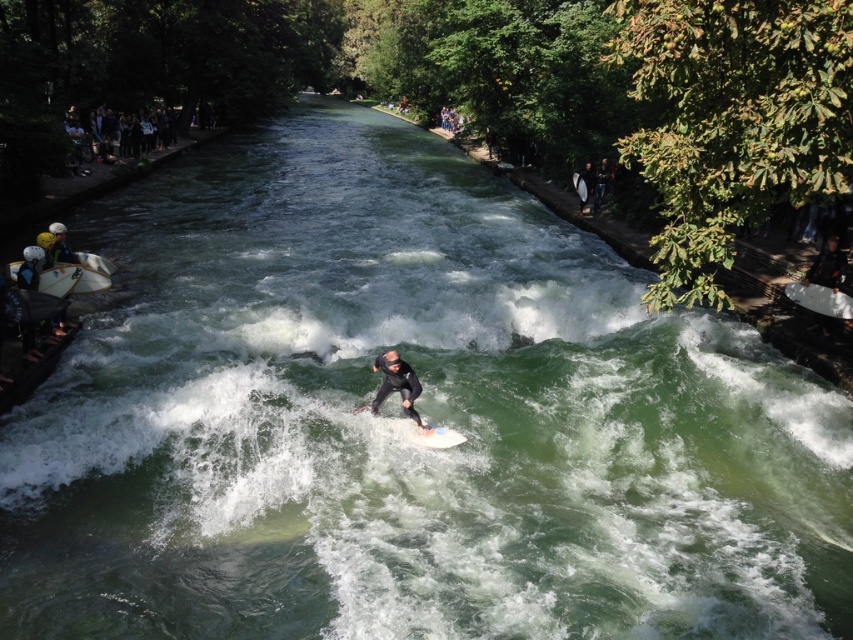
Question: Which object is closer to the camera taking this photo?

Choices:
 (A) dark blue wetsuit at upper right
 (B) black wetsuit surfer at center
 (C) white smooth surfboard at center
 (D) white foam surfboard at center

Answer: (D)

Question: Can you confirm if white glossy surfboard at left is positioned above white smooth surfboard at center?

Choices:
 (A) no
 (B) yes

Answer: (B)

Question: Which object is closer to the camera taking this photo?

Choices:
 (A) dark blue wetsuit at upper right
 (B) white smooth surfboard at center
 (C) black wetsuit surfer at center
 (D) white glossy surfboard at left

Answer: (C)

Question: Does white glossy surfboard at left lie behind white smooth surfboard at center?

Choices:
 (A) yes
 (B) no

Answer: (A)

Question: Does black wetsuit surfer at center appear on the left side of white matte surfboard at center?

Choices:
 (A) no
 (B) yes

Answer: (B)

Question: Which of the following is the farthest from the observer?

Choices:
 (A) (602, 168)
 (B) (410, 376)
 (C) (398, 417)
 (D) (53, 272)

Answer: (A)